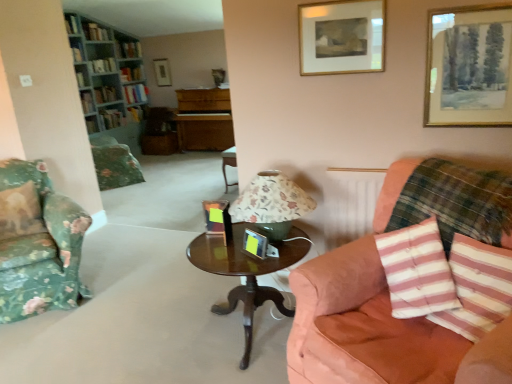
Identify the location of wooden picture frame at upper center, marked as the 2th picture frame in a back-to-front arrangement. (218, 76).

What is the approximate height of green fabric book at upper left, which is the tenth book in top-to-bottom order?

→ green fabric book at upper left, which is the tenth book in top-to-bottom order, is 9.64 inches in height.

At what (x,y) coordinates should I click in order to perform the action: click on wooden picture frame at upper center, the first picture frame from the top. Please return your answer as a coordinate pair (x, y). Looking at the image, I should click on (162, 72).

What do you see at coordinates (272, 204) in the screenshot? The image size is (512, 384). I see `floral fabric lampshade at center` at bounding box center [272, 204].

Where is `hardcover book at upper left, which is the fourth book in top-to-bottom order`? hardcover book at upper left, which is the fourth book in top-to-bottom order is located at coordinates (132, 73).

Is point (96, 124) closer to viewer compared to point (74, 13)?

No, it is behind (74, 13).

Does hardcover book at left, arranged as the eleventh book when viewed from the top, touch green painted wood bookcase at upper left?

No, hardcover book at left, arranged as the eleventh book when viewed from the top, is not beside green painted wood bookcase at upper left.

Considering the relative sizes of hardcover book at left, arranged as the eleventh book when viewed from the top, and green painted wood bookcase at upper left in the image provided, is hardcover book at left, arranged as the eleventh book when viewed from the top, shorter than green painted wood bookcase at upper left?

Correct, hardcover book at left, arranged as the eleventh book when viewed from the top, is not as tall as green painted wood bookcase at upper left.

Considering the relative sizes of hardcover book at left, arranged as the eleventh book when viewed from the top, and green painted wood bookcase at upper left in the image provided, is hardcover book at left, arranged as the eleventh book when viewed from the top, bigger than green painted wood bookcase at upper left?

No, hardcover book at left, arranged as the eleventh book when viewed from the top, is not bigger than green painted wood bookcase at upper left.

Is point (430, 214) behind point (168, 67)?

No, it is in front of (168, 67).

Locate an element on the screen. the 2nd picture frame above the pink striped cushion at right, the 2th pillow positioned from the back (from a real-world perspective) is located at coordinates (162, 72).

Is pink striped cushion at right, which is the 2th pillow in front-to-back order, not near wooden picture frame at upper center, which is counted as the 5th picture frame, starting from the right?

Absolutely, pink striped cushion at right, which is the 2th pillow in front-to-back order, is distant from wooden picture frame at upper center, which is counted as the 5th picture frame, starting from the right.

Looking at this image, from a real-world perspective, is pink striped cushion at right, which is the 2th pillow in front-to-back order, over wooden picture frame at upper center, which ranks as the 1th picture frame in back-to-front order?

No.

Considering the positions of objects floral fabric lampshade at center and hardcover book at upper left, positioned as the eighth book in bottom-to-top order, in the image provided, who is behind, floral fabric lampshade at center or hardcover book at upper left, positioned as the eighth book in bottom-to-top order,?

hardcover book at upper left, positioned as the eighth book in bottom-to-top order, is further away from the camera.

Between point (282, 236) and point (121, 73), which one is positioned behind?

The point (121, 73) is farther from the camera.

What are the coordinates of `table lamp below the hardcover book at upper left, which is the fourth book in top-to-bottom order (from the image's perspective)` in the screenshot? It's located at (x=272, y=204).

Considering the relative sizes of floral fabric lampshade at center and hardcover book at upper left, which is the fourth book in top-to-bottom order, in the image provided, is floral fabric lampshade at center taller than hardcover book at upper left, which is the fourth book in top-to-bottom order,?

Correct, floral fabric lampshade at center is much taller as hardcover book at upper left, which is the fourth book in top-to-bottom order.

How different are the orientations of hardcover book at upper left, the 5th book from the bottom, and pink striped pillow at lower right, the 3th pillow viewed from the back, in degrees?

They differ by 122 degrees in their facing directions.

Looking at the image, does hardcover book at upper left, the 5th book from the bottom, seem bigger or smaller compared to pink striped pillow at lower right, marked as the 2th pillow in a right-to-left arrangement?

In the image, hardcover book at upper left, the 5th book from the bottom, appears to be larger than pink striped pillow at lower right, marked as the 2th pillow in a right-to-left arrangement.

Considering the sizes of hardcover book at upper left, the 5th book from the bottom, and pink striped pillow at lower right, the 3th pillow viewed from the back, in the image, is hardcover book at upper left, the 5th book from the bottom, taller or shorter than pink striped pillow at lower right, the 3th pillow viewed from the back,?

hardcover book at upper left, the 5th book from the bottom, is shorter than pink striped pillow at lower right, the 3th pillow viewed from the back.

Is hardcover book at upper left, positioned as the eighth book in bottom-to-top order, to the right of hardcover book at upper left, which is counted as the 4th book, starting from the bottom, from the viewer's perspective?

In fact, hardcover book at upper left, positioned as the eighth book in bottom-to-top order, is to the left of hardcover book at upper left, which is counted as the 4th book, starting from the bottom.

Considering the sizes of hardcover book at upper left, positioned as the eighth book in bottom-to-top order, and hardcover book at upper left, which appears as the eighth book when viewed from the top, in the image, is hardcover book at upper left, positioned as the eighth book in bottom-to-top order, wider or thinner than hardcover book at upper left, which appears as the eighth book when viewed from the top,?

In the image, hardcover book at upper left, positioned as the eighth book in bottom-to-top order, appears to be wider than hardcover book at upper left, which appears as the eighth book when viewed from the top.

Would you consider hardcover book at upper left, which is the fourth book in top-to-bottom order, to be distant from hardcover book at upper left, which appears as the eighth book when viewed from the top?

No.

Is hardcover book at upper left, positioned as the eighth book in bottom-to-top order, positioned with its back to hardcover book at upper left, which appears as the eighth book when viewed from the top?

No, hardcover book at upper left, positioned as the eighth book in bottom-to-top order, is not facing away from hardcover book at upper left, which appears as the eighth book when viewed from the top.

Is gold-framed painting at upper right, the fourth picture frame positioned from the top, next to hardcover book at upper left, which is counted as the 4th book, starting from the bottom?

No, gold-framed painting at upper right, the fourth picture frame positioned from the top, is not beside hardcover book at upper left, which is counted as the 4th book, starting from the bottom.

Could you tell me if gold-framed painting at upper right, positioned as the 5th picture frame in back-to-front order, is facing hardcover book at upper left, which appears as the eighth book when viewed from the top?

No, gold-framed painting at upper right, positioned as the 5th picture frame in back-to-front order, is not facing towards hardcover book at upper left, which appears as the eighth book when viewed from the top.

Is point (460, 36) farther from viewer compared to point (129, 117)?

No.

Who is taller, gold-framed painting at upper right, positioned as the 5th picture frame in back-to-front order, or hardcover book at upper left, which is counted as the 4th book, starting from the bottom?

gold-framed painting at upper right, positioned as the 5th picture frame in back-to-front order.

From a real-world perspective, does gold-framed picture at upper right, acting as the 2th picture frame starting from the right, stand above gold-framed painting at upper right, which ranks as the 1th picture frame in front-to-back order?

Yes, from a real-world perspective, gold-framed picture at upper right, acting as the 2th picture frame starting from the right, is above gold-framed painting at upper right, which ranks as the 1th picture frame in front-to-back order.

Consider the image. From the image's perspective, which is above, gold-framed picture at upper right, arranged as the third picture frame when viewed from the back, or gold-framed painting at upper right, positioned as the first picture frame in right-to-left order?

gold-framed picture at upper right, arranged as the third picture frame when viewed from the back, appears higher in the image.

Between gold-framed picture at upper right, which ranks as the 3th picture frame in top-to-bottom order, and gold-framed painting at upper right, the fourth picture frame positioned from the top, which one appears on the right side from the viewer's perspective?

Positioned to the right is gold-framed painting at upper right, the fourth picture frame positioned from the top.

Is gold-framed picture at upper right, positioned as the fourth picture frame in left-to-right order, wider than gold-framed painting at upper right, the second picture frame in the bottom-to-top sequence?

Incorrect, the width of gold-framed picture at upper right, positioned as the fourth picture frame in left-to-right order, does not surpass that of gold-framed painting at upper right, the second picture frame in the bottom-to-top sequence.

This screenshot has width=512, height=384. What are the coordinates of `the 4th book below the green painted wood bookcase at upper left (from a real-world perspective)` in the screenshot? It's located at (92, 124).

From the pink striped cushion at right, the 2th pillow positioned from the back, count 5th picture frames backward and point to it. Please provide its 2D coordinates.

[(162, 72)]

Which object lies further to the anchor point floral fabric lampshade at center, pink striped pillow at lower right, the 3th pillow viewed from the back, or pink striped cushion at right, which is counted as the first pillow, starting from the right?

pink striped pillow at lower right, the 3th pillow viewed from the back, is positioned further to the anchor floral fabric lampshade at center.

When comparing their distances from pink striped pillow at lower right, the 1th pillow viewed from the front, does wooden picture frame at upper center, which is the 2th picture frame from left to right, or gold-framed painting at upper right, the second picture frame in the bottom-to-top sequence, seem closer?

gold-framed painting at upper right, the second picture frame in the bottom-to-top sequence, lies closer to pink striped pillow at lower right, the 1th pillow viewed from the front, than the other object.

Looking at the image, which one is located closer to pink striped cushion at right, the third pillow viewed from the left, hardcover book at upper left, which is the fourth book in top-to-bottom order, or metallic gold picture frame at center, arranged as the 5th picture frame when viewed from the top?

metallic gold picture frame at center, arranged as the 5th picture frame when viewed from the top.

Considering their positions, is metallic gold picture frame at center, arranged as the 3th picture frame when viewed from the right, positioned closer to hardcover book at upper left, which appears as the eighth book when viewed from the top, than green fabric book at upper left, which ranks as the 2th book in bottom-to-top order?

The object closer to hardcover book at upper left, which appears as the eighth book when viewed from the top, is green fabric book at upper left, which ranks as the 2th book in bottom-to-top order.

Looking at the image, which one is located further to wooden picture frame at upper center, the first picture frame from the top, hardcover book at upper left, the 5th book from the bottom, or metallic gold picture frame at center, which is counted as the first picture frame, starting from the bottom?

metallic gold picture frame at center, which is counted as the first picture frame, starting from the bottom, lies further to wooden picture frame at upper center, the first picture frame from the top, than the other object.

Considering their positions, is gold-framed painting at upper right, the second picture frame in the bottom-to-top sequence, positioned closer to suede-like pink couch at right than hardcover book at upper left, which is the fourth book in top-to-bottom order?

Among the two, gold-framed painting at upper right, the second picture frame in the bottom-to-top sequence, is located nearer to suede-like pink couch at right.

From the image, which object appears to be nearer to hardcover book at upper left, which is the fourth book in top-to-bottom order, hardcover book at upper left, the 10th book ordered from the bottom, or pink striped pillow at lower right, the 3th pillow viewed from the back?

Among the two, hardcover book at upper left, the 10th book ordered from the bottom, is located nearer to hardcover book at upper left, which is the fourth book in top-to-bottom order.

Looking at the image, which one is located further to floral fabric pillow at left, which is counted as the first pillow, starting from the back, hardcover book at upper left, the third book from the top, or hardcover book at left, arranged as the eleventh book when viewed from the top?

hardcover book at upper left, the third book from the top, is further to floral fabric pillow at left, which is counted as the first pillow, starting from the back.

Identify the location of picture frame between floral fabric armchair at left, which ranks as the 2th chair in back-to-front order, and hardcover book at center, placed as the 6th book when sorted from top to bottom, along the z-axis. (218, 76).

Where is `bookcase between floral fabric lampshade at center and hardcover book at upper left, arranged as the 9th book when ordered from the bottom, in the front-back direction`? bookcase between floral fabric lampshade at center and hardcover book at upper left, arranged as the 9th book when ordered from the bottom, in the front-back direction is located at coordinates (108, 72).

Identify the location of pillow between gold-framed painting at upper right, which ranks as the fifth picture frame in left-to-right order, and hardcover book at upper left, which is the third book in bottom-to-top order, in the front-back direction. This screenshot has height=384, width=512. (20, 212).

The width and height of the screenshot is (512, 384). What are the coordinates of `bookcase located between dark wood coffee table at center and hardcover book at upper left, the 5th book from the bottom, in the depth direction` in the screenshot? It's located at (108, 72).